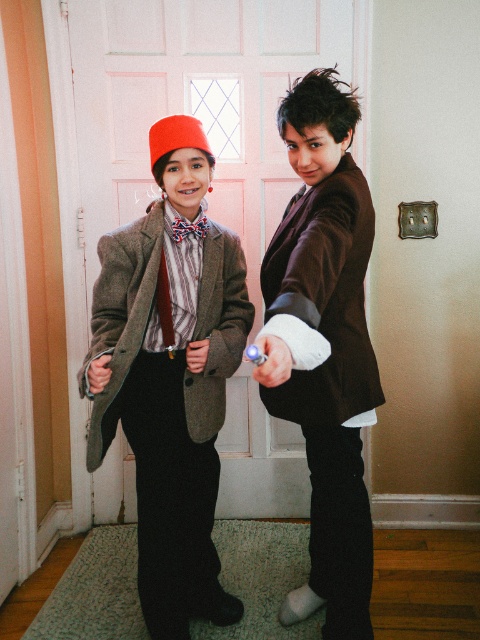
Who is positioned more to the right, matte brown coat at center or red satin tie at center?

Positioned to the right is matte brown coat at center.

Is matte brown coat at center bigger than red satin tie at center?

→ Indeed, matte brown coat at center has a larger size compared to red satin tie at center.

Identify the location of matte brown coat at center. (324, 346).

Is matte brown coat at center positioned in front of matte brown blazer at center?

No, matte brown coat at center is behind matte brown blazer at center.

Which is more to the left, matte brown coat at center or matte brown blazer at center?

matte brown coat at center is more to the left.

You are a GUI agent. You are given a task and a screenshot of the screen. Output one action in this format:
    pyautogui.click(x=<x>, y=<y>)
    Task: Click on the matte brown coat at center
    The height and width of the screenshot is (640, 480).
    Given the screenshot: What is the action you would take?
    pyautogui.click(x=324, y=346)

Can you confirm if matte brown blazer at center is positioned below matte wool tie at center?

Correct, matte brown blazer at center is located below matte wool tie at center.

Does matte brown blazer at center appear over matte wool tie at center?

No, matte brown blazer at center is not above matte wool tie at center.

At what (x,y) coordinates should I click in order to perform the action: click on matte brown blazer at center. Please return your answer as a coordinate pair (x, y). The width and height of the screenshot is (480, 640). Looking at the image, I should click on (324, 346).